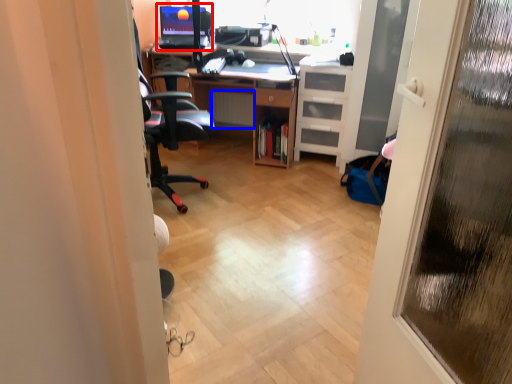
Question: Which object appears farthest to the camera in this image, desktop computer (highlighted by a red box) or radiator (highlighted by a blue box)?

Choices:
 (A) desktop computer
 (B) radiator

Answer: (B)